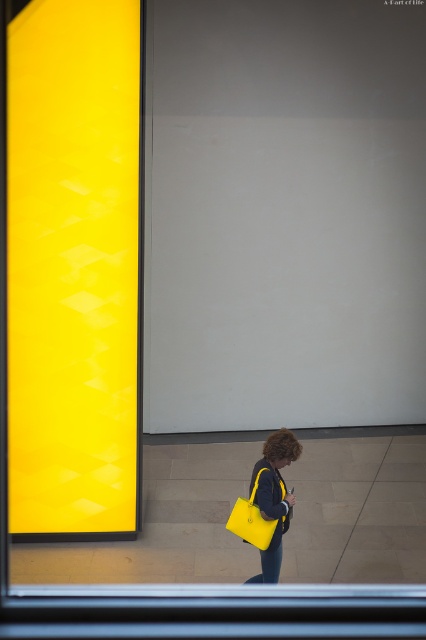
Can you confirm if matte yellow handbag at lower center is positioned to the right of matte yellow shoulder bag at lower center?

Indeed, matte yellow handbag at lower center is positioned on the right side of matte yellow shoulder bag at lower center.

Locate an element on the screen. Image resolution: width=426 pixels, height=640 pixels. matte yellow handbag at lower center is located at coordinates (273, 497).